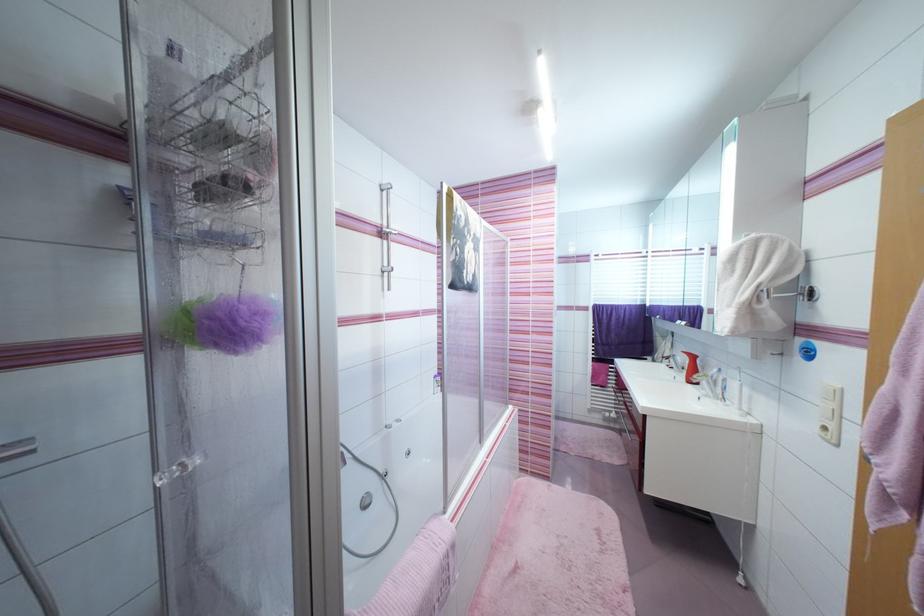
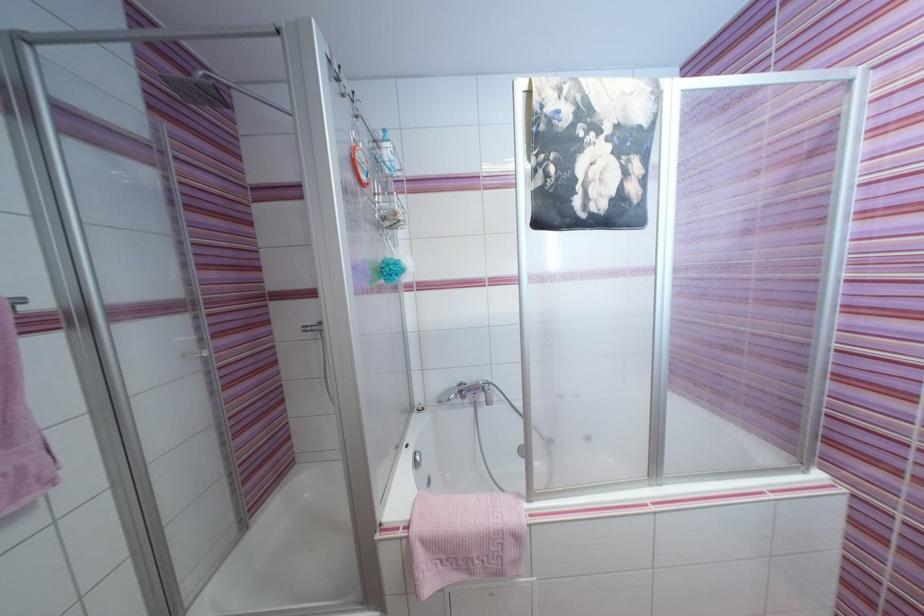
Locate, in the second image, the point that corresponds to point (458, 548) in the first image.

(521, 539)